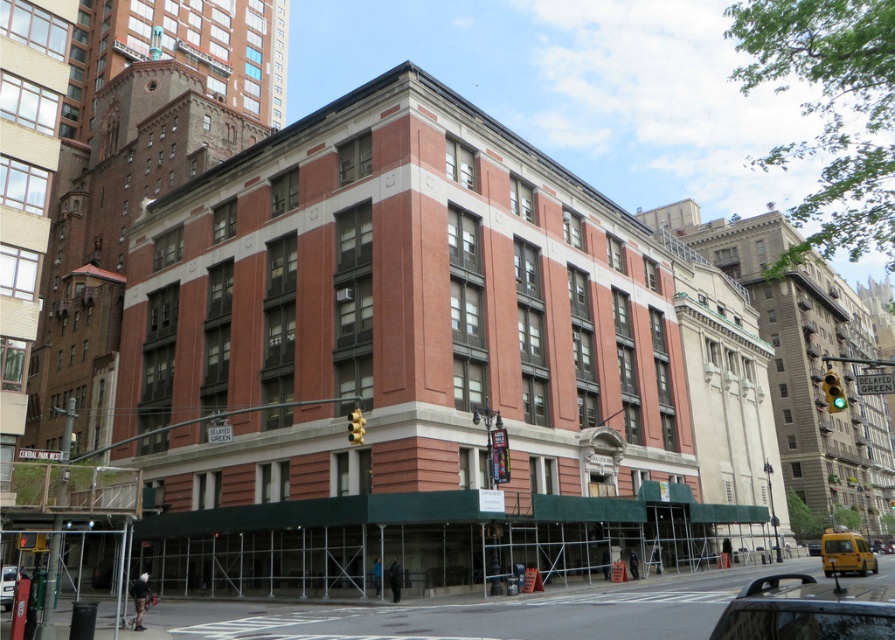
You are a delivery person needing to park your 5.5 meter long truck between the shiny black car at lower right and the yellow matte van at lower right. Can you fit your truck in the space between them?

The distance between the shiny black car at lower right and the yellow matte van at lower right is 14.69 meters, which is more than enough to accommodate a 5.5 meter long truck.

You are a pedestrian standing at the center of the street facing the building. You see a shiny black car at lower right and a metallic silver car at lower left. Which car is closer to your right side?

The shiny black car at lower right is closer to your right side because it is positioned to the right of the metallic silver car at lower left.

You are a delivery person who needs to park your vehicle between the shiny black car at lower right and the yellow matte van at lower right. Which vehicle should you park behind to ensure your vehicle is hidden from view?

You should park behind the yellow matte van at lower right because it is taller than the shiny black car at lower right, so parking behind it would better hide your vehicle from view.